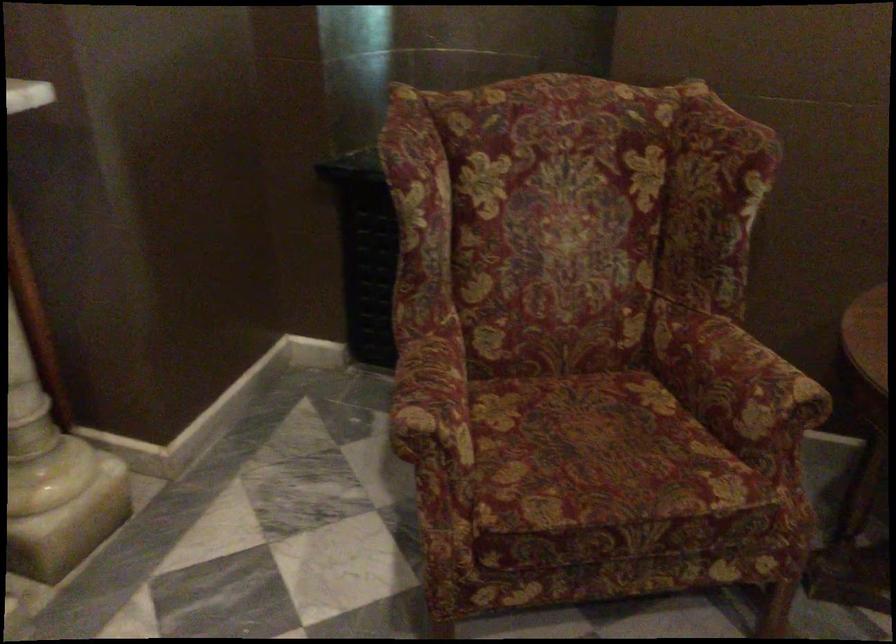
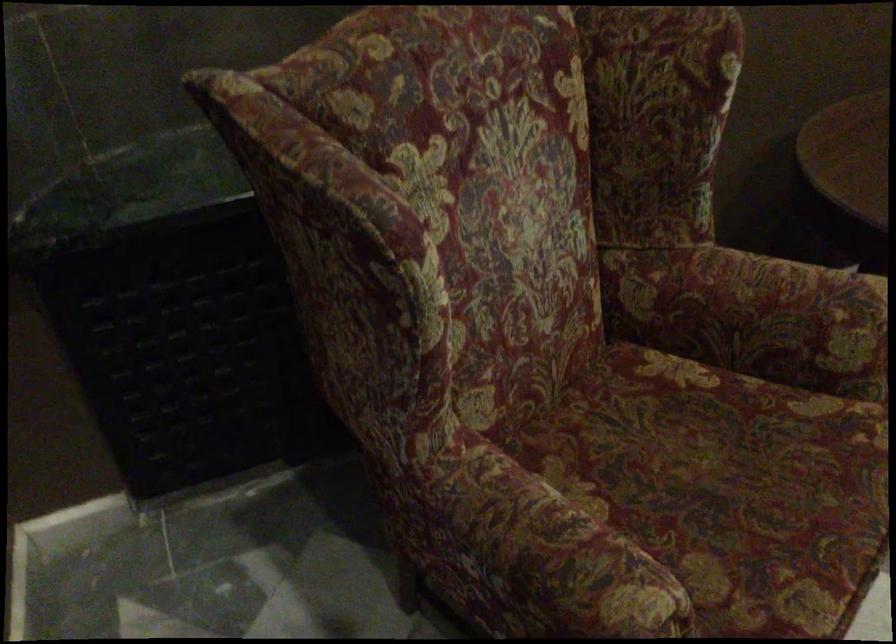
Where in the second image is the point corresponding to (584,449) from the first image?

(726, 486)